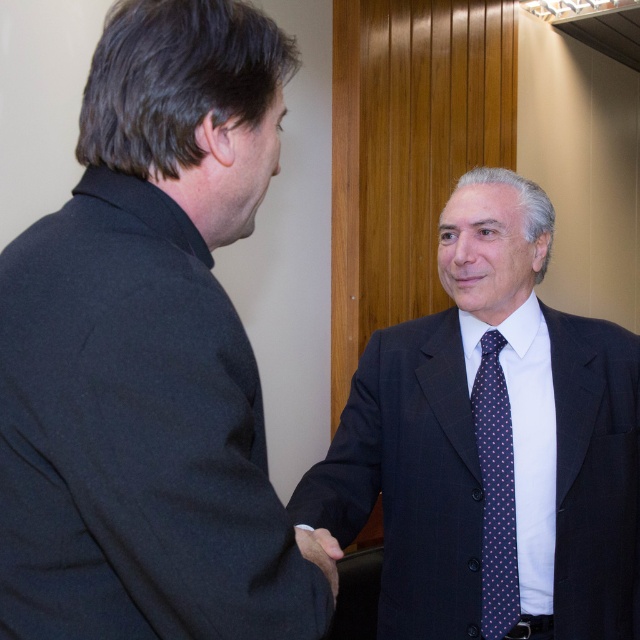
Is dark blue suit at center thinner than dark blue dotted tie at right?

Incorrect, dark blue suit at center's width is not less than dark blue dotted tie at right's.

Is dark blue suit at center smaller than dark blue dotted tie at right?

No, dark blue suit at center is not smaller than dark blue dotted tie at right.

You are a GUI agent. You are given a task and a screenshot of the screen. Output one action in this format:
    pyautogui.click(x=<x>, y=<y>)
    Task: Click on the dark blue suit at center
    The height and width of the screenshot is (640, 640).
    Given the screenshot: What is the action you would take?
    pyautogui.click(x=492, y=442)

Does black wool suit at left appear on the left side of dark blue suit at center?

Yes, black wool suit at left is to the left of dark blue suit at center.

This screenshot has width=640, height=640. What do you see at coordinates (148, 353) in the screenshot?
I see `black wool suit at left` at bounding box center [148, 353].

Does point (212, 480) lie behind point (384, 440)?

No, it is in front of (384, 440).

At what (x,y) coordinates should I click in order to perform the action: click on black wool suit at left. Please return your answer as a coordinate pair (x, y). The image size is (640, 640). Looking at the image, I should click on (148, 353).

Is point (502, 364) closer to viewer compared to point (316, 556)?

No, (502, 364) is behind (316, 556).

Does dark blue suit at center have a greater height compared to dark brown leather hand at center?

Yes, dark blue suit at center is taller than dark brown leather hand at center.

The image size is (640, 640). What do you see at coordinates (492, 442) in the screenshot?
I see `dark blue suit at center` at bounding box center [492, 442].

Identify the location of dark blue suit at center. (492, 442).